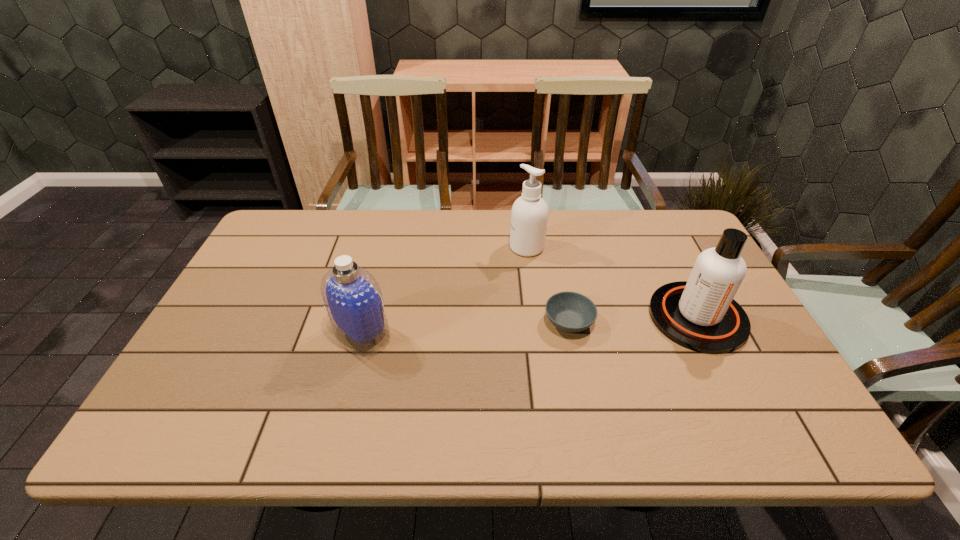
Image resolution: width=960 pixels, height=540 pixels. I want to click on vacant region located 0.260m on the front of the soup bowl, so click(592, 438).

You are a GUI agent. You are given a task and a screenshot of the screen. Output one action in this format:
    pyautogui.click(x=<x>, y=<y>)
    Task: Click on the object at the far edge
    
    Given the screenshot: What is the action you would take?
    pyautogui.click(x=529, y=215)

Where is `object that is positioned at the right edge`? object that is positioned at the right edge is located at coordinates (700, 314).

You are a GUI agent. You are given a task and a screenshot of the screen. Output one action in this format:
    pyautogui.click(x=<x>, y=<y>)
    Task: Click on the free point at the far edge
    Image resolution: width=960 pixels, height=540 pixels.
    Given the screenshot: What is the action you would take?
    pyautogui.click(x=497, y=211)

Locate an element on the screen. The image size is (960, 540). vacant space at the left edge is located at coordinates (200, 340).

At what (x,y) coordinates should I click in order to perform the action: click on free space at the right edge. Please return your answer as a coordinate pair (x, y). The image size is (960, 540). Looking at the image, I should click on (738, 363).

I want to click on vacant space at the near left corner of the desktop, so click(x=180, y=421).

Image resolution: width=960 pixels, height=540 pixels. What are the coordinates of `free point between the rightmost cleansing agent and the leftmost cleansing agent` in the screenshot? It's located at (530, 326).

You are a GUI agent. You are given a task and a screenshot of the screen. Output one action in this format:
    pyautogui.click(x=<x>, y=<y>)
    Task: Click on the vacant space that is in between the farthest cleansing agent and the shortest object
    The height and width of the screenshot is (540, 960).
    Given the screenshot: What is the action you would take?
    pyautogui.click(x=548, y=285)

Identify the location of free space between the soup bowl and the farthest object. Image resolution: width=960 pixels, height=540 pixels. (548, 285).